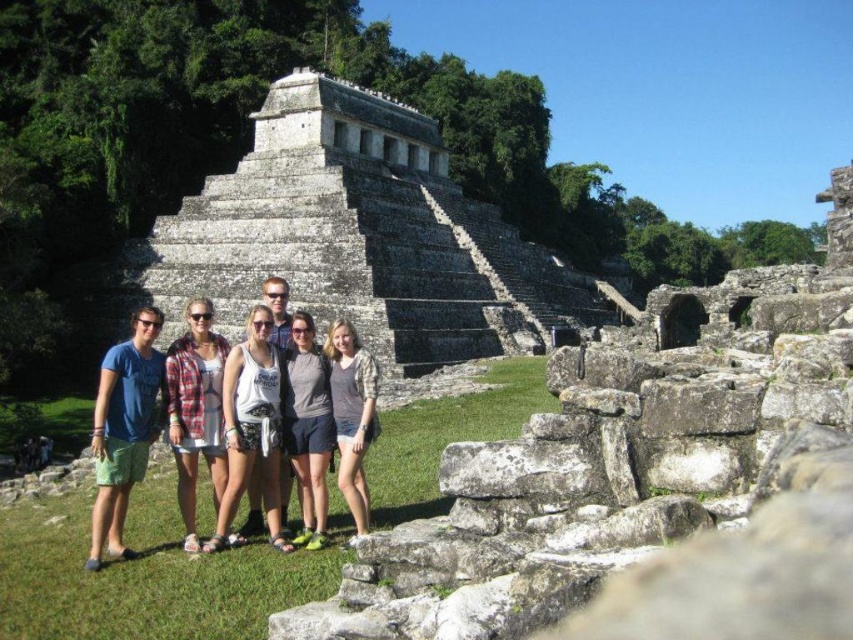
Question: Does white cotton tank top at center have a greater width compared to gray fabric shorts at center?

Choices:
 (A) yes
 (B) no

Answer: (A)

Question: Among these points, which one is nearest to the camera?

Choices:
 (A) (169, 420)
 (B) (337, 364)

Answer: (A)

Question: Estimate the real-world distances between objects in this image. Which object is closer to the plaid fabric shirt at center?

Choices:
 (A) gray cotton shirt at center
 (B) gray fabric shorts at center
 (C) white cotton tank top at center

Answer: (C)

Question: In this image, where is plaid fabric shirt at center located relative to gray cotton shirt at center?

Choices:
 (A) above
 (B) below

Answer: (A)

Question: Which point is farther to the camera?

Choices:
 (A) (97, 378)
 (B) (335, 378)

Answer: (A)

Question: Can you confirm if gray fabric shorts at center is positioned above gray cotton shirt at center?

Choices:
 (A) yes
 (B) no

Answer: (B)